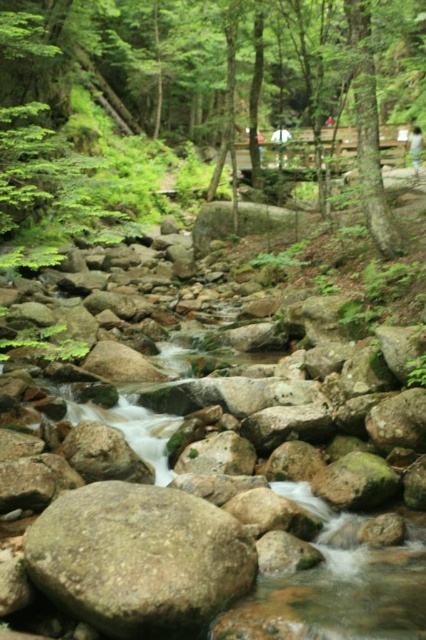
Identify the location of green matte tree at upper center. Image resolution: width=426 pixels, height=640 pixels. (203, 97).

Which is more to the right, green matte tree at upper center or gray rough boulder at center?

A: green matte tree at upper center

Does point (45, 196) come farther from viewer compared to point (135, 577)?

Yes.

Find the location of a particular element. This screenshot has height=640, width=426. green matte tree at upper center is located at coordinates pyautogui.click(x=203, y=97).